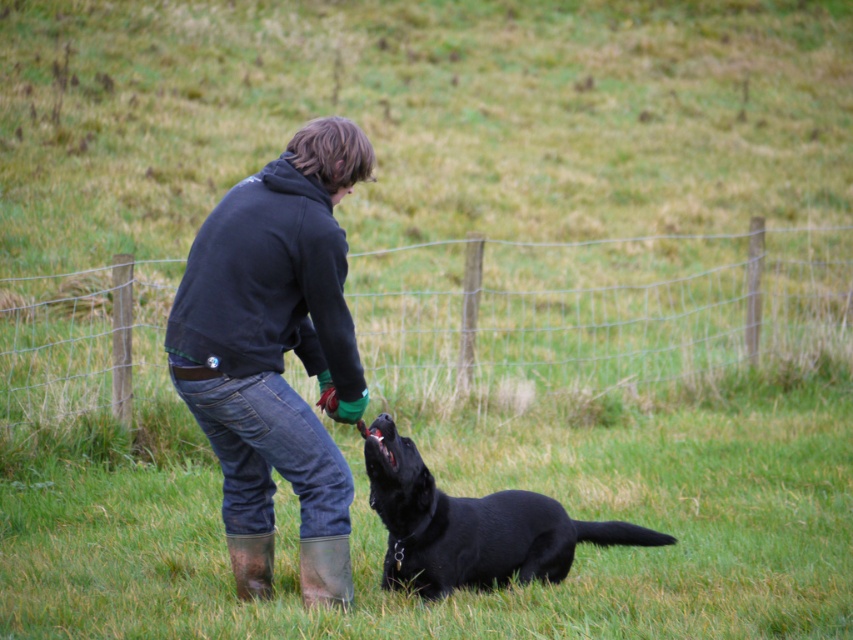
Question: Observing the image, what is the correct spatial positioning of black matte dog at lower center in reference to brown rubber boot at lower left?

Choices:
 (A) left
 (B) right

Answer: (B)

Question: Does wire mesh fence at center lie behind brown rubber boot at lower left?

Choices:
 (A) no
 (B) yes

Answer: (A)

Question: Does wire mesh fence at center appear on the left side of brown rubber boot at lower left?

Choices:
 (A) yes
 (B) no

Answer: (B)

Question: Which of the following is the farthest from the observer?

Choices:
 (A) black cotton sweatshirt at center
 (B) brown rubber boot at lower left
 (C) dark blue hoodie at center
 (D) black matte dog at lower center

Answer: (B)

Question: Which point is farther to the camera?

Choices:
 (A) (248, 586)
 (B) (403, 349)
 (C) (368, 438)

Answer: (B)

Question: Among these points, which one is farthest from the camera?

Choices:
 (A) (393, 540)
 (B) (25, 397)
 (C) (273, 173)

Answer: (B)